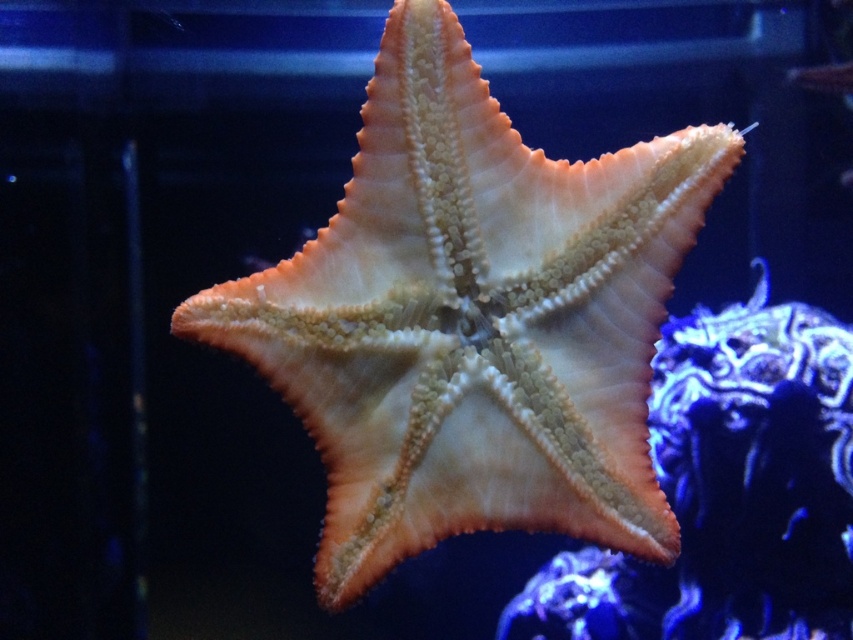
Question: From the image, what is the correct spatial relationship of orange textured starfish at center in relation to orange rough starfish at center?

Choices:
 (A) above
 (B) below

Answer: (A)

Question: Which of the following is the farthest from the observer?

Choices:
 (A) orange rough starfish at center
 (B) orange textured starfish at center

Answer: (A)

Question: Among these points, which one is farthest from the camera?

Choices:
 (A) (561, 262)
 (B) (732, 588)

Answer: (B)

Question: Among these points, which one is farthest from the camera?

Choices:
 (A) (572, 564)
 (B) (662, 296)

Answer: (A)

Question: Can you confirm if orange textured starfish at center is positioned to the right of orange rough starfish at center?

Choices:
 (A) yes
 (B) no

Answer: (B)

Question: Is orange textured starfish at center further to the viewer compared to orange rough starfish at center?

Choices:
 (A) yes
 (B) no

Answer: (B)